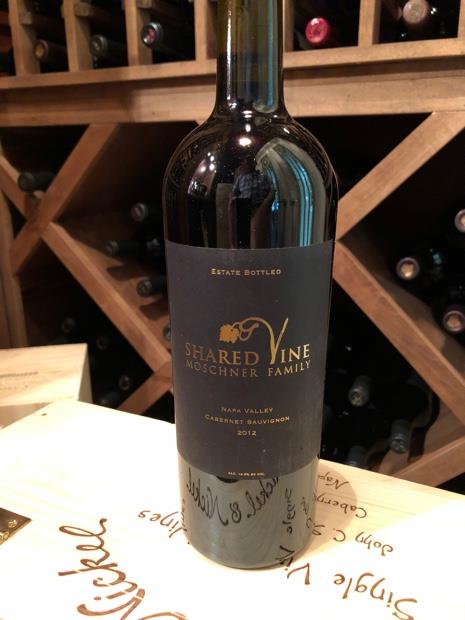
Locate an element on the screen. Image resolution: width=465 pixels, height=620 pixels. bottle is located at coordinates (217, 174).